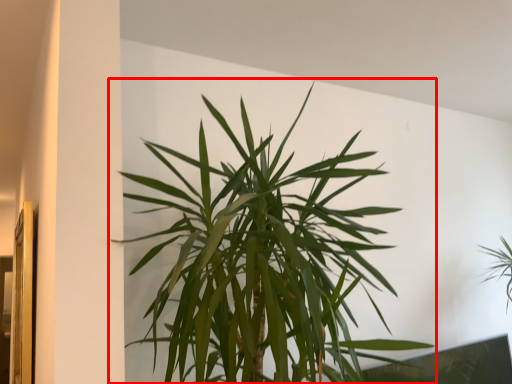
Question: Considering the relative positions of houseplant (annotated by the red box) and houseplant in the image provided, where is houseplant (annotated by the red box) located with respect to the staircase?

Choices:
 (A) left
 (B) right

Answer: (A)